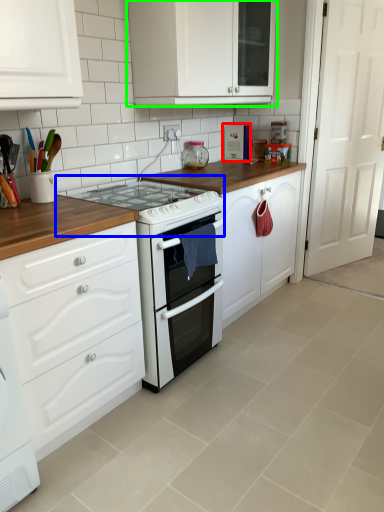
Question: Which object is positioned closest to appliance (highlighted by a red box)? Select from gas stove (highlighted by a blue box) and cabinetry (highlighted by a green box).

Choices:
 (A) gas stove
 (B) cabinetry

Answer: (B)